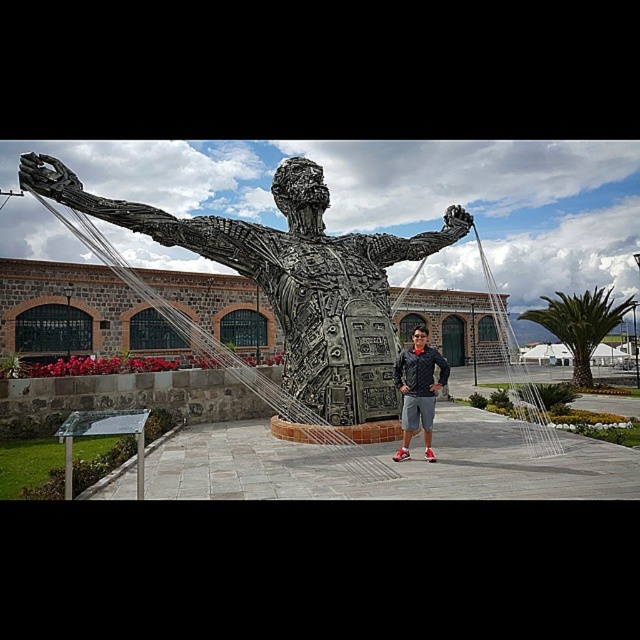
You are a photographer trying to capture a photo of the shiny metallic statue at center and the matte black jacket at center. Which object should you zoom in on to ensure both are in focus without moving the camera?

You should zoom in on the shiny metallic statue at center because it is thinner than the matte black jacket at center, so focusing on the smaller statue will help keep both objects in focus.

You are standing at the point marked as point (291, 280) in the image. What object is located exactly at that point?

The shiny metallic statue at center is located exactly at point (291, 280).